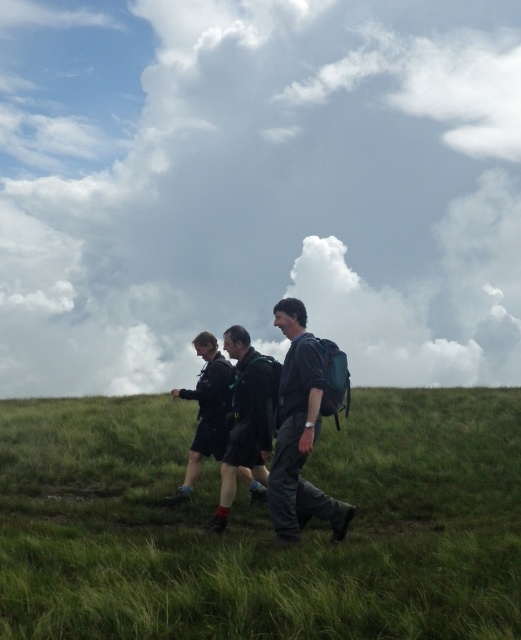
Can you confirm if green grassy at center is smaller than dark blue backpack at center?

Incorrect, green grassy at center is not smaller in size than dark blue backpack at center.

Who is lower down, green grassy at center or dark blue backpack at center?

Positioned lower is green grassy at center.

At what (x,y) coordinates should I click in order to perform the action: click on green grassy at center. Please return your answer as a coordinate pair (x, y). This screenshot has width=521, height=640. Looking at the image, I should click on (262, 524).

Who is positioned more to the right, cloudy sky at upper center or dark gray fabric backpack at center?

Positioned to the right is dark gray fabric backpack at center.

Does cloudy sky at upper center appear over dark gray fabric backpack at center?

Correct, cloudy sky at upper center is located above dark gray fabric backpack at center.

Is point (502, 136) behind point (288, 314)?

Yes, it is.

Locate an element on the screen. This screenshot has height=640, width=521. cloudy sky at upper center is located at coordinates (257, 188).

Who is lower down, green grassy at center or dark gray fabric backpack at center?

green grassy at center is below.

Identify the location of green grassy at center. (262, 524).

Where is `green grassy at center`? This screenshot has width=521, height=640. green grassy at center is located at coordinates (262, 524).